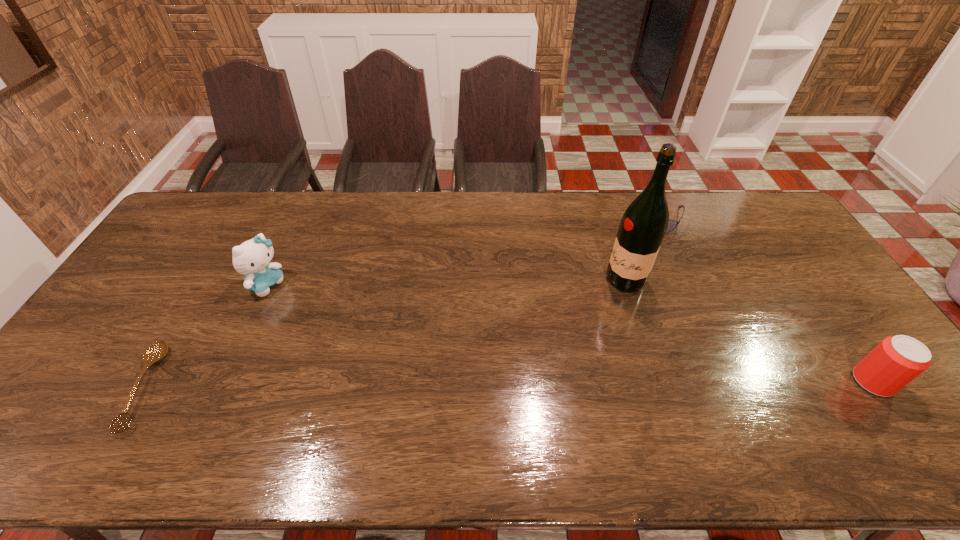
Locate which object is the second closest to the second shortest object. Please provide its 2D coordinates. Your answer should be formatted as a tuple, i.e. [(x, y)], where the tuple contains the x and y coordinates of a point satisfying the conditions above.

[(896, 361)]

You are a GUI agent. You are given a task and a screenshot of the screen. Output one action in this format:
    pyautogui.click(x=<x>, y=<y>)
    Task: Click on the object that ranks as the closest to the tallest object
    
    Given the screenshot: What is the action you would take?
    pyautogui.click(x=672, y=224)

In order to click on free location that satisfies the following two spatial constraints: 1. on the back side of the third object from left to right; 2. on the left side of the shortest object in this screenshot , I will do `click(206, 280)`.

Where is `vacant space that satisfies the following two spatial constraints: 1. on the back side of the second object from right to left; 2. on the right side of the ladle`? vacant space that satisfies the following two spatial constraints: 1. on the back side of the second object from right to left; 2. on the right side of the ladle is located at coordinates (245, 216).

Find the location of a particular element. The height and width of the screenshot is (540, 960). free spot that satisfies the following two spatial constraints: 1. on the back side of the sunglasses; 2. on the right side of the tallest object is located at coordinates (605, 216).